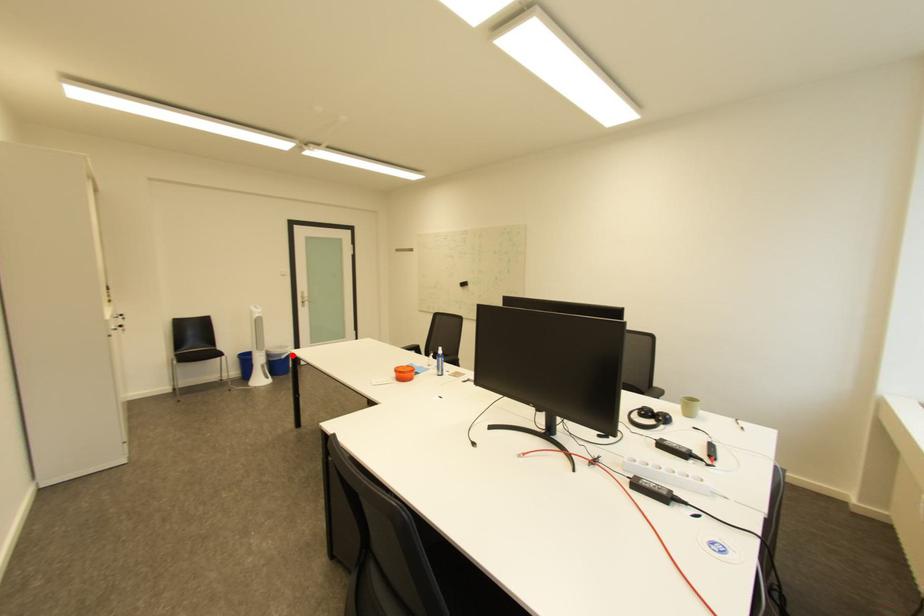
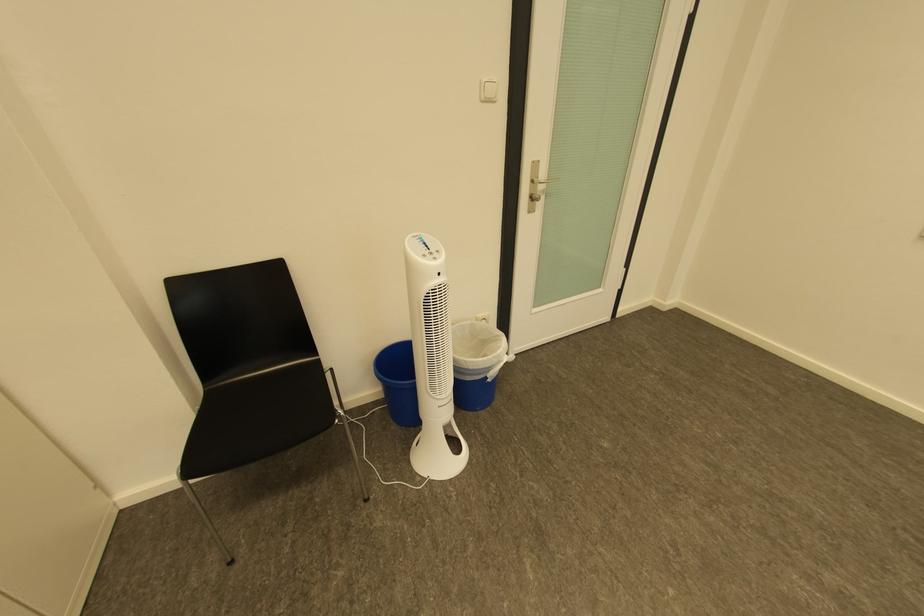
Question: I am providing you with two images of the same scene from different viewpoints. Given a red point in image1, look at the same physical point in image2. Is it:

Choices:
 (A) Closer to the viewpoint
 (B) Farther from the viewpoint

Answer: (B)